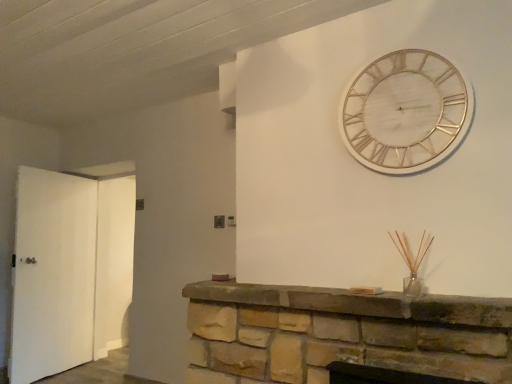
What do you see at coordinates (113, 263) in the screenshot? I see `white matte door at left, arranged as the second door when viewed from the left` at bounding box center [113, 263].

This screenshot has width=512, height=384. Find the location of `white matte door at left, arranged as the second door when viewed from the left`. white matte door at left, arranged as the second door when viewed from the left is located at coordinates (113, 263).

The height and width of the screenshot is (384, 512). What do you see at coordinates (360, 303) in the screenshot?
I see `brown stone fireplace at center` at bounding box center [360, 303].

Image resolution: width=512 pixels, height=384 pixels. What do you see at coordinates (52, 274) in the screenshot?
I see `white matte door at left, which is counted as the 1th door, starting from the left` at bounding box center [52, 274].

What do you see at coordinates (406, 111) in the screenshot? The image size is (512, 384). I see `white wood wall clock at upper right` at bounding box center [406, 111].

Find the location of a particular element. Image resolution: width=512 pixels, height=384 pixels. white matte door at left, acting as the 1th door starting from the right is located at coordinates (113, 263).

Which point is more forward, (441, 99) or (72, 222)?

Positioned in front is point (441, 99).

Locate an element on the screen. This screenshot has width=512, height=384. the 1st door behind when counting from the white wood wall clock at upper right is located at coordinates (52, 274).

Considering the sizes of objects white wood wall clock at upper right and white matte door at left, which is the second door from right to left, in the image provided, who is shorter, white wood wall clock at upper right or white matte door at left, which is the second door from right to left,?

Standing shorter between the two is white wood wall clock at upper right.

Is white wood wall clock at upper right in contact with white matte door at left, which is the second door from right to left?

white wood wall clock at upper right and white matte door at left, which is the second door from right to left, are not in contact.

Is point (103, 221) positioned behind point (397, 72)?

That is True.

Find the location of a particular element. wall clock above the white matte door at left, acting as the 1th door starting from the right (from the image's perspective) is located at coordinates (406, 111).

From the image's perspective, is white matte door at left, acting as the 1th door starting from the right, located above or below white wood wall clock at upper right?

white matte door at left, acting as the 1th door starting from the right, is below white wood wall clock at upper right.

Based on the photo, does white matte door at left, acting as the 1th door starting from the right, have a lesser height compared to white wood wall clock at upper right?

No.

From the image's perspective, is white matte door at left, which is the second door from right to left, over white wood wall clock at upper right?

No, from the image's perspective, white matte door at left, which is the second door from right to left, is not over white wood wall clock at upper right.

Does white matte door at left, which is counted as the 1th door, starting from the left, touch white wood wall clock at upper right?

They are not placed beside each other.

Does white matte door at left, which is the second door from right to left, have a greater width compared to white wood wall clock at upper right?

Correct, the width of white matte door at left, which is the second door from right to left, exceeds that of white wood wall clock at upper right.

Considering the sizes of brown stone fireplace at center and white matte door at left, which is the second door from right to left, in the image, is brown stone fireplace at center taller or shorter than white matte door at left, which is the second door from right to left,?

Clearly, brown stone fireplace at center is shorter compared to white matte door at left, which is the second door from right to left.

Does brown stone fireplace at center have a smaller size compared to white matte door at left, which is the second door from right to left?

Yes, brown stone fireplace at center is smaller than white matte door at left, which is the second door from right to left.

Between point (457, 301) and point (91, 262), which one is positioned in front?

The point (457, 301) is in front.

Is brown stone fireplace at center positioned with its back to white matte door at left, which is the second door from right to left?

No, brown stone fireplace at center is not facing the opposite direction of white matte door at left, which is the second door from right to left.

Considering the positions of objects white matte door at left, which is the second door from right to left, and white matte door at left, arranged as the second door when viewed from the left, in the image provided, who is more to the right, white matte door at left, which is the second door from right to left, or white matte door at left, arranged as the second door when viewed from the left,?

Positioned to the right is white matte door at left, arranged as the second door when viewed from the left.

Is white matte door at left, which is the second door from right to left, beside white matte door at left, acting as the 1th door starting from the right?

They are not placed beside each other.

Is white matte door at left, which is counted as the 1th door, starting from the left, inside the boundaries of white matte door at left, arranged as the second door when viewed from the left, or outside?

white matte door at left, which is counted as the 1th door, starting from the left, lies outside white matte door at left, arranged as the second door when viewed from the left.

Is white matte door at left, acting as the 1th door starting from the right, surrounding brown stone fireplace at center?

Actually, brown stone fireplace at center is outside white matte door at left, acting as the 1th door starting from the right.

Does point (102, 340) come closer to viewer compared to point (229, 299)?

No, it is not.

Between white matte door at left, acting as the 1th door starting from the right, and brown stone fireplace at center, which one has smaller size?

Smaller between the two is brown stone fireplace at center.

Consider the image. Does white matte door at left, acting as the 1th door starting from the right, turn towards brown stone fireplace at center?

No, white matte door at left, acting as the 1th door starting from the right, is not aimed at brown stone fireplace at center.

From the image's perspective, does white matte door at left, which is the second door from right to left, appear higher than brown stone fireplace at center?

No, from the image's perspective, white matte door at left, which is the second door from right to left, is not over brown stone fireplace at center.

Based on their positions, is white matte door at left, which is the second door from right to left, located to the left or right of brown stone fireplace at center?

Based on their positions, white matte door at left, which is the second door from right to left, is located to the left of brown stone fireplace at center.

Based on their sizes in the image, would you say white matte door at left, which is counted as the 1th door, starting from the left, is bigger or smaller than brown stone fireplace at center?

white matte door at left, which is counted as the 1th door, starting from the left, is bigger than brown stone fireplace at center.

From a real-world perspective, who is located lower, white matte door at left, which is the second door from right to left, or brown stone fireplace at center?

brown stone fireplace at center.

Find the location of a particular element. Image resolution: width=512 pixels, height=384 pixels. wall clock lying on the right of white matte door at left, which is the second door from right to left is located at coordinates (406, 111).

Find the location of a particular element. The width and height of the screenshot is (512, 384). wall clock in front of the white matte door at left, arranged as the second door when viewed from the left is located at coordinates (406, 111).

When comparing their distances from brown stone fireplace at center, does white matte door at left, acting as the 1th door starting from the right, or white wood wall clock at upper right seem closer?

white wood wall clock at upper right lies closer to brown stone fireplace at center than the other object.

Estimate the real-world distances between objects in this image. Which object is further from white matte door at left, which is counted as the 1th door, starting from the left, brown stone fireplace at center or white wood wall clock at upper right?

white wood wall clock at upper right lies further to white matte door at left, which is counted as the 1th door, starting from the left, than the other object.

Looking at the image, which one is located further to white wood wall clock at upper right, brown stone fireplace at center or white matte door at left, which is the second door from right to left?

white matte door at left, which is the second door from right to left.

Based on their spatial positions, is white matte door at left, acting as the 1th door starting from the right, or brown stone fireplace at center closer to white matte door at left, which is the second door from right to left?

white matte door at left, acting as the 1th door starting from the right, lies closer to white matte door at left, which is the second door from right to left, than the other object.

Looking at the image, which one is located further to white matte door at left, arranged as the second door when viewed from the left, white matte door at left, which is the second door from right to left, or brown stone fireplace at center?

brown stone fireplace at center is further to white matte door at left, arranged as the second door when viewed from the left.

Estimate the real-world distances between objects in this image. Which object is closer to white matte door at left, which is counted as the 1th door, starting from the left, white matte door at left, arranged as the second door when viewed from the left, or white wood wall clock at upper right?

white matte door at left, arranged as the second door when viewed from the left, is positioned closer to the anchor white matte door at left, which is counted as the 1th door, starting from the left.

Which object lies nearer to the anchor point brown stone fireplace at center, white wood wall clock at upper right or white matte door at left, arranged as the second door when viewed from the left?

white wood wall clock at upper right is closer to brown stone fireplace at center.

Based on their spatial positions, is white wood wall clock at upper right or brown stone fireplace at center further from white matte door at left, arranged as the second door when viewed from the left?

white wood wall clock at upper right lies further to white matte door at left, arranged as the second door when viewed from the left, than the other object.

What are the coordinates of `wall clock between brown stone fireplace at center and white matte door at left, acting as the 1th door starting from the right, along the z-axis` in the screenshot? It's located at (406, 111).

You are a GUI agent. You are given a task and a screenshot of the screen. Output one action in this format:
    pyautogui.click(x=<x>, y=<y>)
    Task: Click on the door between white matte door at left, which is counted as the 1th door, starting from the left, and white wood wall clock at upper right
    The width and height of the screenshot is (512, 384).
    Given the screenshot: What is the action you would take?
    pyautogui.click(x=113, y=263)

I want to click on door positioned between brown stone fireplace at center and white matte door at left, arranged as the second door when viewed from the left, from near to far, so click(x=52, y=274).

Locate an element on the screen. mantle between white matte door at left, which is counted as the 1th door, starting from the left, and white wood wall clock at upper right from left to right is located at coordinates (360, 303).